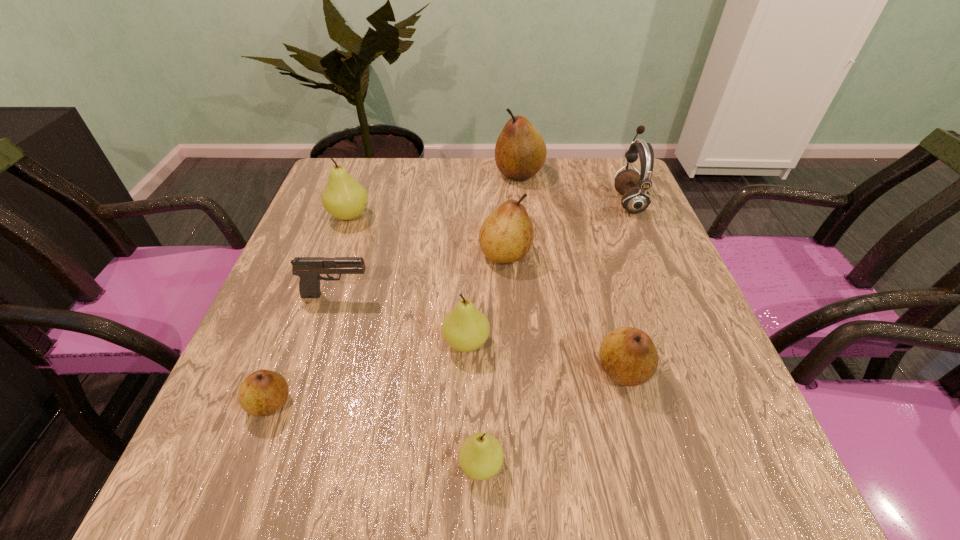
This screenshot has width=960, height=540. Identify the location of free space located on the right of the fifth nearest pear. (575, 254).

At what (x,y) coordinates should I click in order to perform the action: click on free space located on the back of the second nearest green pear. Please return your answer as a coordinate pair (x, y). Looking at the image, I should click on (468, 282).

Find the location of a particular element. vacant area located on the left of the rightmost brown pear is located at coordinates (396, 370).

You are a GUI agent. You are given a task and a screenshot of the screen. Output one action in this format:
    pyautogui.click(x=<x>, y=<y>)
    Task: Click on the free space located aim along the barrel of the fifth farthest object
    This screenshot has height=540, width=960.
    Given the screenshot: What is the action you would take?
    pyautogui.click(x=414, y=295)

Where is `vacant space situated 0.380m on the back of the leftmost brown pear`? Image resolution: width=960 pixels, height=540 pixels. vacant space situated 0.380m on the back of the leftmost brown pear is located at coordinates click(x=330, y=246).

At what (x,y) coordinates should I click in order to perform the action: click on free space located 0.130m on the back of the nearest green pear. Please return your answer as a coordinate pair (x, y). Looking at the image, I should click on (481, 374).

I want to click on earphone that is at the far edge, so click(633, 185).

This screenshot has width=960, height=540. Identify the location of object located in the near edge section of the desktop. (480, 457).

Locate an element on the screen. pistol located in the left edge section of the desktop is located at coordinates (309, 269).

Image resolution: width=960 pixels, height=540 pixels. I want to click on earphone that is positioned at the right edge, so point(633,185).